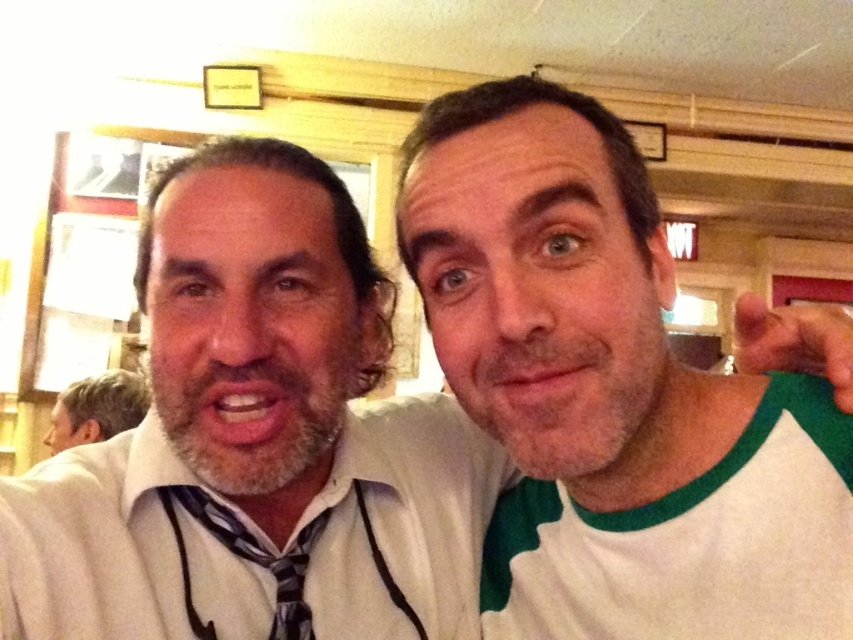
Question: Which object appears closest to the camera in this image?

Choices:
 (A) white cotton t-shirt at right
 (B) white/green raglan shirt at right
 (C) gray hair at left

Answer: (B)

Question: Which object is positioned closest to the striped fabric tie at center?

Choices:
 (A) white/green raglan shirt at right
 (B) gray hair at left

Answer: (A)

Question: Can you confirm if white/green raglan shirt at right is wider than white cotton t-shirt at right?

Choices:
 (A) no
 (B) yes

Answer: (B)

Question: Does white cotton t-shirt at right appear on the left side of striped fabric tie at center?

Choices:
 (A) no
 (B) yes

Answer: (A)

Question: In this image, where is white/green raglan shirt at right located relative to striped fabric tie at center?

Choices:
 (A) right
 (B) left

Answer: (A)

Question: Which point appears farthest from the camera in this image?

Choices:
 (A) [x=117, y=403]
 (B) [x=300, y=632]
 (C) [x=543, y=522]

Answer: (A)